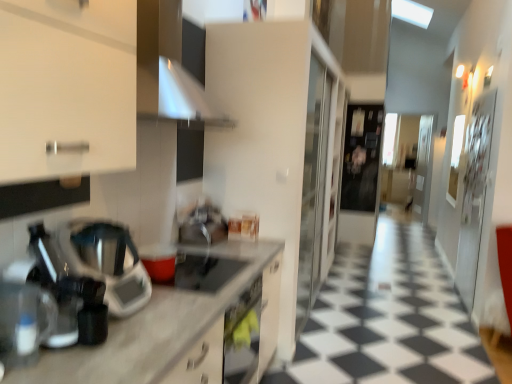
Locate an element on the screen. empty space that is to the right of metallic silver blender at left is located at coordinates (170, 306).